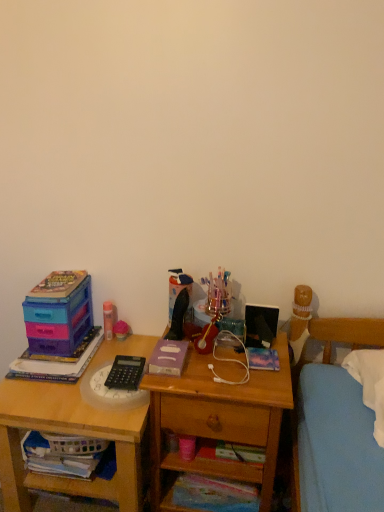
Locate an element on the screen. free spot behind metallic blue book at center, which ranks as the 1th book in right-to-left order is located at coordinates (251, 340).